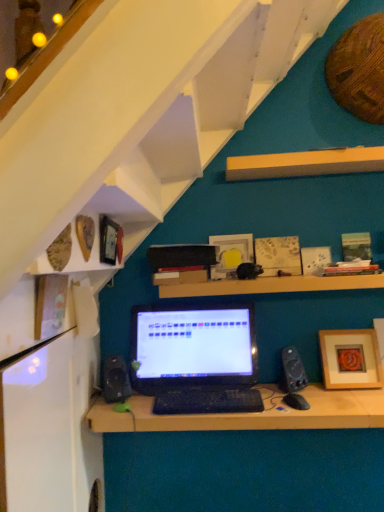
Where is `free space on the front side of black matte computer mouse at lower right`? This screenshot has height=512, width=384. free space on the front side of black matte computer mouse at lower right is located at coordinates (298, 414).